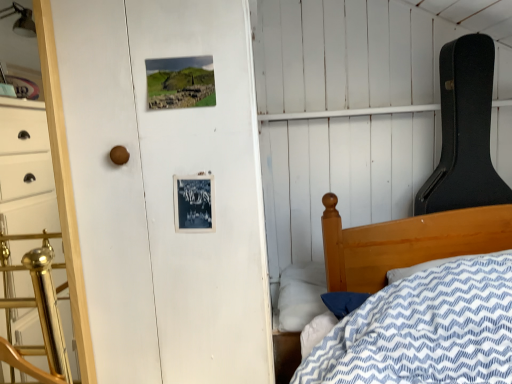
Question: Is white soft pillow at lower center inside or outside of brushed brass dresser at left?

Choices:
 (A) inside
 (B) outside

Answer: (B)

Question: Considering the relative positions of white soft pillow at lower center and brushed brass dresser at left in the image provided, is white soft pillow at lower center to the left or to the right of brushed brass dresser at left?

Choices:
 (A) right
 (B) left

Answer: (A)

Question: From the image's perspective, is white soft pillow at lower center located above or below brushed brass dresser at left?

Choices:
 (A) above
 (B) below

Answer: (B)

Question: From the image's perspective, is brushed brass dresser at left located above or below white soft pillow at lower center?

Choices:
 (A) above
 (B) below

Answer: (A)

Question: From a real-world perspective, is brushed brass dresser at left above or below white soft pillow at lower center?

Choices:
 (A) below
 (B) above

Answer: (B)

Question: Considering the positions of brushed brass dresser at left and white soft pillow at lower center in the image, is brushed brass dresser at left taller or shorter than white soft pillow at lower center?

Choices:
 (A) tall
 (B) short

Answer: (A)

Question: Considering the relative positions of brushed brass dresser at left and white soft pillow at lower center in the image provided, is brushed brass dresser at left to the left or to the right of white soft pillow at lower center?

Choices:
 (A) right
 (B) left

Answer: (B)